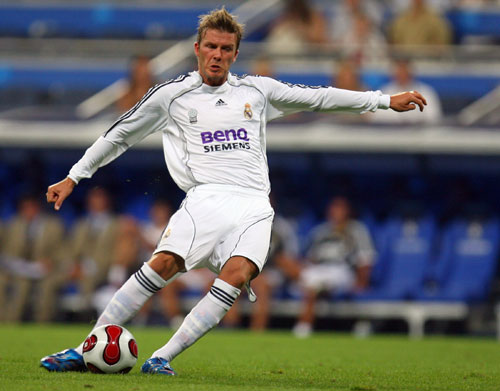
Identify the location of 2 white socks with muted coloring. (196, 325), (128, 303).